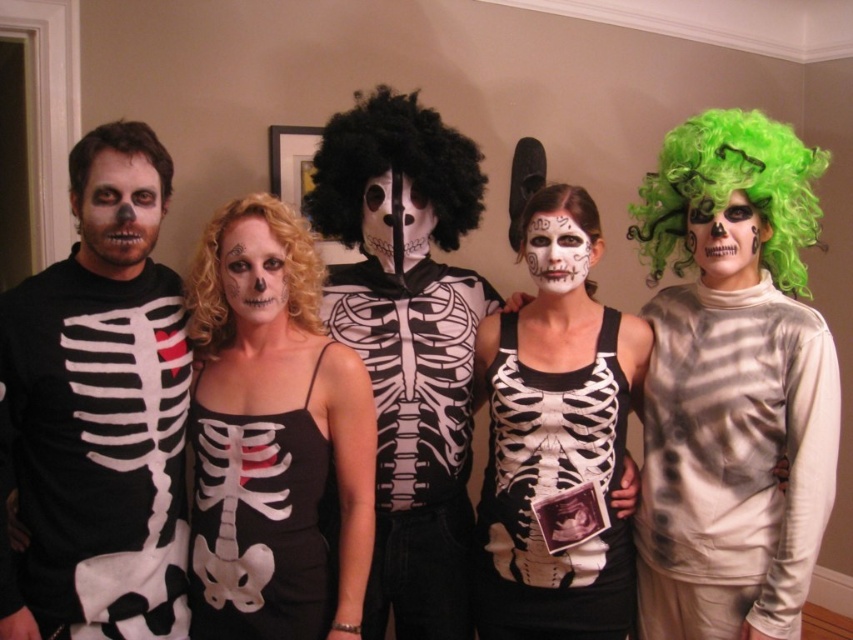
Who is positioned more to the left, green curly wig at right or matte black face paint at center?

Positioned to the left is matte black face paint at center.

Is green curly wig at right to the left of matte black face paint at center from the viewer's perspective?

In fact, green curly wig at right is to the right of matte black face paint at center.

Locate an element on the screen. Image resolution: width=853 pixels, height=640 pixels. green curly wig at right is located at coordinates (730, 192).

Does point (3, 486) come in front of point (532, 244)?

Yes, point (3, 486) is closer to viewer.

Consider the image. Who is higher up, matte black skeleton shirt at left or white matte face paint at center?

white matte face paint at center is higher up.

Who is more distant from viewer, (x=142, y=588) or (x=570, y=268)?

Positioned behind is point (x=570, y=268).

You are a GUI agent. You are given a task and a screenshot of the screen. Output one action in this format:
    pyautogui.click(x=<x>, y=<y>)
    Task: Click on the matte black skeleton shirt at left
    The image size is (853, 640).
    Given the screenshot: What is the action you would take?
    pyautogui.click(x=97, y=412)

Is black curly wig at center further to camera compared to dark brown curly wig at left?

That is True.

Which is in front, point (460, 205) or point (152, 150)?

Point (152, 150) is in front.

Is point (372, 97) less distant than point (111, 136)?

That is False.

Locate an element on the screen. The image size is (853, 640). black curly wig at center is located at coordinates (393, 166).